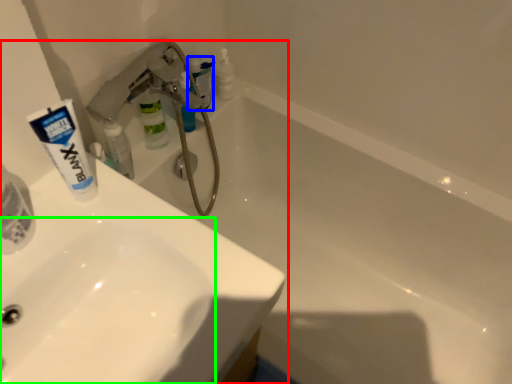
Question: Based on their relative distances, which object is farther from sink (highlighted by a red box)? Choose from toiletry (highlighted by a blue box) and sink (highlighted by a green box).

Choices:
 (A) toiletry
 (B) sink

Answer: (A)